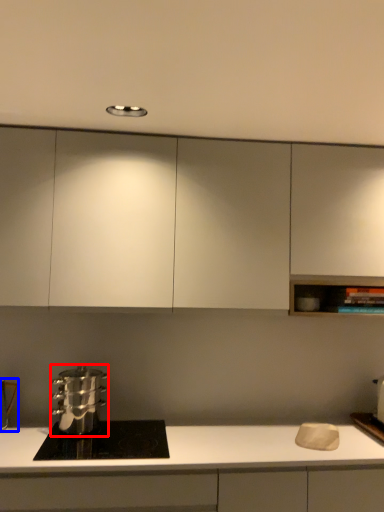
Question: Which object appears farthest to the camera in this image, kitchen appliance (highlighted by a red box) or appliance (highlighted by a blue box)?

Choices:
 (A) kitchen appliance
 (B) appliance

Answer: (B)